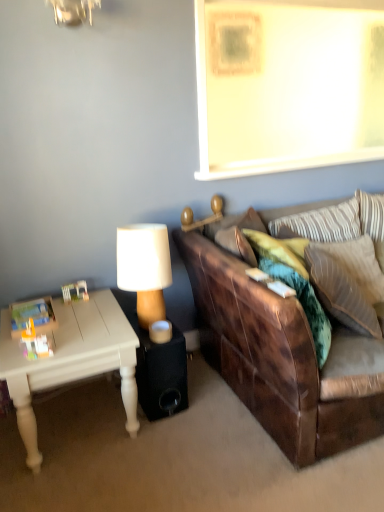
Identify the location of spots to the right of white painted wood coffee table at lower left. (190, 434).